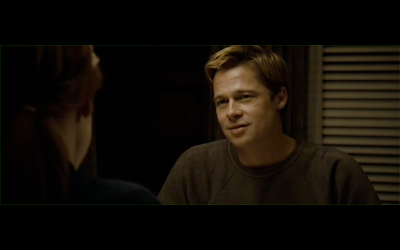
Locate an element on the screen. Image resolution: width=400 pixels, height=250 pixels. table is located at coordinates (83, 160).